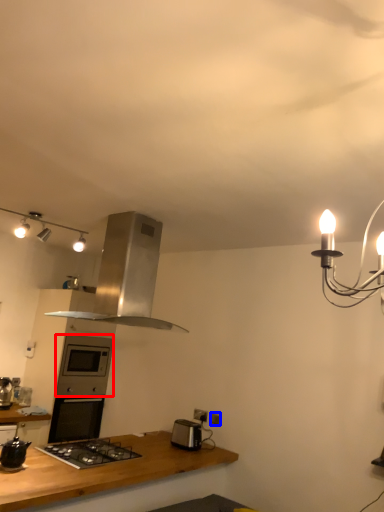
Question: Among these objects, which one is nearest to the camera, oven (highlighted by a red box) or electric outlet (highlighted by a blue box)?

Choices:
 (A) oven
 (B) electric outlet

Answer: (B)